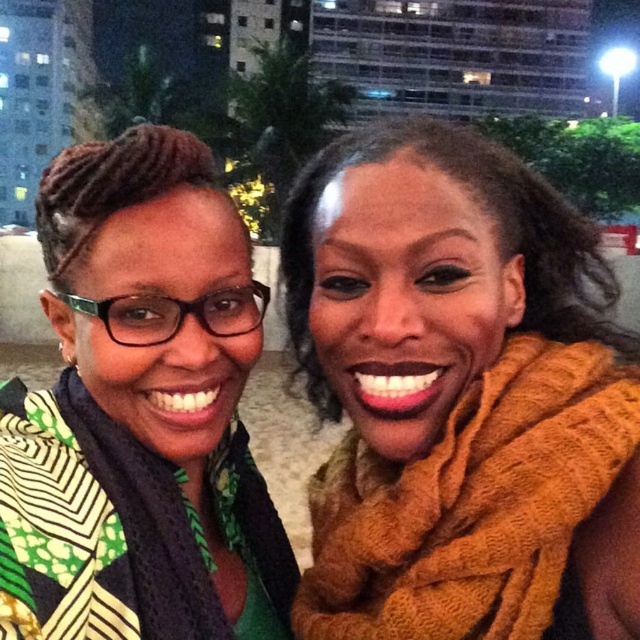
You are a photographer trying to capture a clear shot of both the green printed fabric at left and the orange fuzzy scarf at right. Since you can only focus on one object at a time, which one should you choose to ensure the other is still somewhat in focus?

You should focus on the green printed fabric at left because it is closer to the viewer than the orange fuzzy scarf at right. By focusing on the closer object, the depth of field may still keep the farther one somewhat in focus.

You are a fashion designer analyzing the outfit coordination in the image. You notice the green printed fabric at left and the orange fuzzy scarf at right. Which of these two items has a greater surface area in the image?

The green printed fabric at left has a greater surface area than the orange fuzzy scarf at right.

You are trying to decide which scarf to wear for a night out. You have both the green printed fabric at left and the orange fuzzy scarf at right. Based on the image, which one is wider?

The green printed fabric at left might be wider than orange fuzzy scarf at right according to the image.